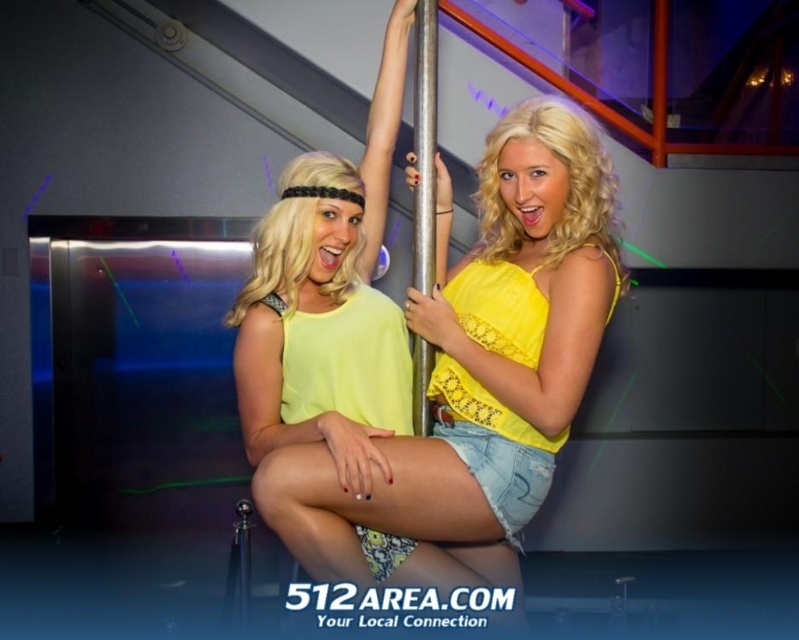
Question: Which of the following is the farthest from the observer?

Choices:
 (A) coord(416,284)
 (B) coord(432,556)

Answer: (A)

Question: Which of the following is the farthest from the observer?

Choices:
 (A) (476, 336)
 (B) (416, 74)

Answer: (B)

Question: Is yellow denim shorts at center behind metallic pole at center?

Choices:
 (A) yes
 (B) no

Answer: (B)

Question: Can you confirm if yellow denim shorts at center is smaller than metallic pole at center?

Choices:
 (A) yes
 (B) no

Answer: (B)

Question: Does yellow denim shorts at center come behind metallic pole at center?

Choices:
 (A) no
 (B) yes

Answer: (A)